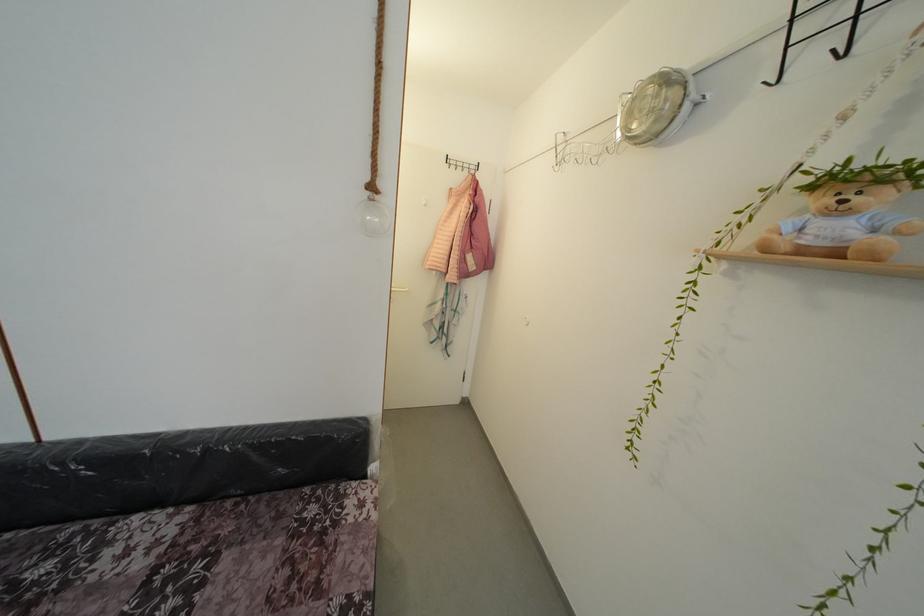
Where would you pull the white door handle? Please return your answer as a coordinate pair (x, y).

(396, 284)